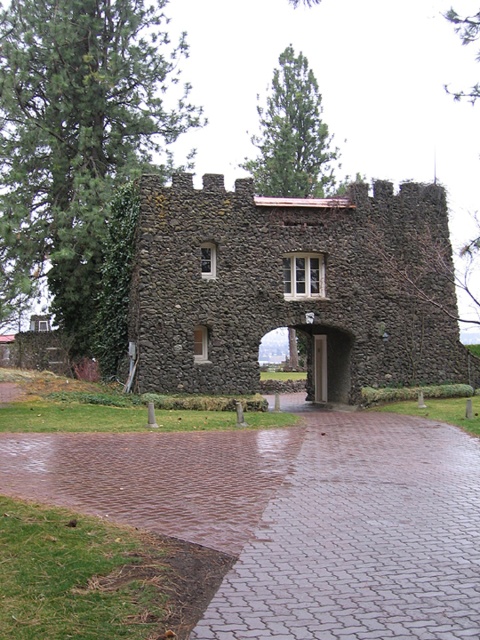
Identify the location of rustic stone gate at center. 294,288.

In the scene shown: Does rustic stone gate at center have a lesser width compared to green ivy at left?

No.

At what (x,y) coordinates should I click in order to perform the action: click on rustic stone gate at center. Please return your answer as a coordinate pair (x, y). Looking at the image, I should click on (294, 288).

Between point (381, 497) and point (109, 35), which one is positioned behind?

Point (109, 35)

Does point (288, 528) come behind point (58, 118)?

No, it is in front of (58, 118).

Is point (450, 566) behind point (29, 74)?

No, (450, 566) is in front of (29, 74).

This screenshot has height=640, width=480. I want to click on brick paved path at center, so click(x=361, y=538).

Does rustic stone gate at center have a greater width compared to brick paved path at center?

Yes.

From the picture: Is rustic stone gate at center bigger than brick paved path at center?

Yes, rustic stone gate at center is bigger than brick paved path at center.

Measure the distance between rustic stone gate at center and camera.

rustic stone gate at center and camera are 31.51 meters apart from each other.

You are a GUI agent. You are given a task and a screenshot of the screen. Output one action in this format:
    pyautogui.click(x=<x>, y=<y>)
    Task: Click on the rustic stone gate at center
    This screenshot has height=640, width=480.
    Given the screenshot: What is the action you would take?
    pyautogui.click(x=294, y=288)